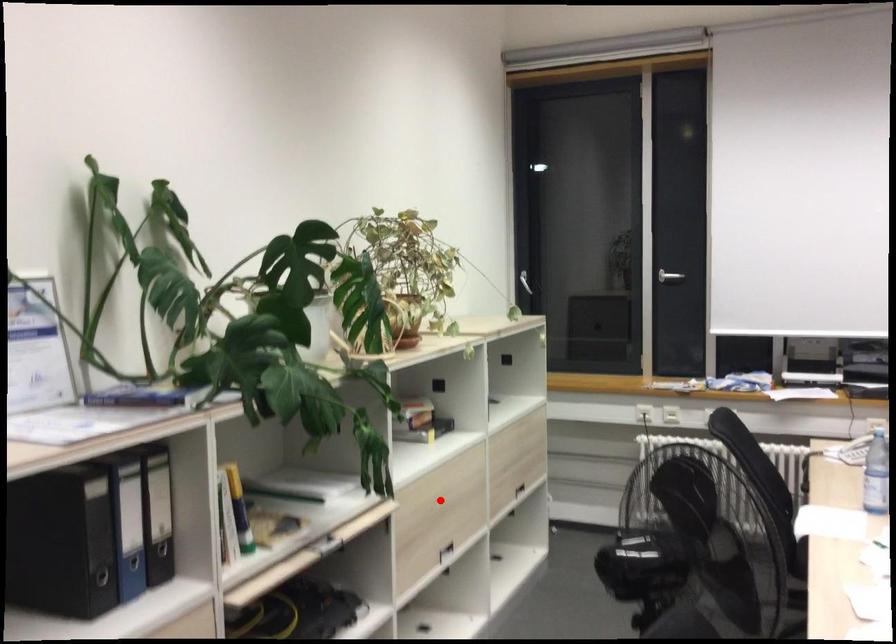
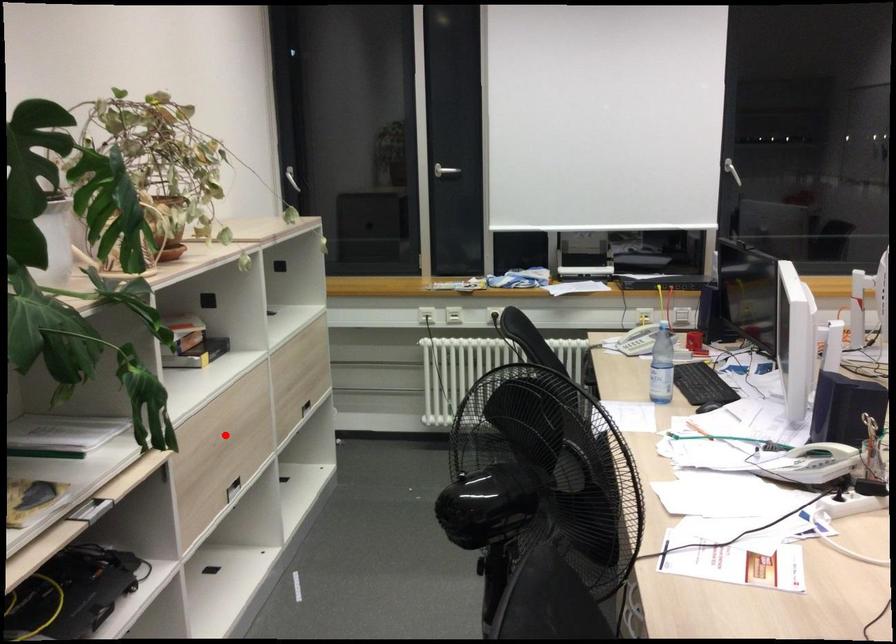
I am providing you with two images of the same scene from different viewpoints. A red point is marked on the first image and another point is marked on the second image. Do the highlighted points in image1 and image2 indicate the same real-world spot?

Yes